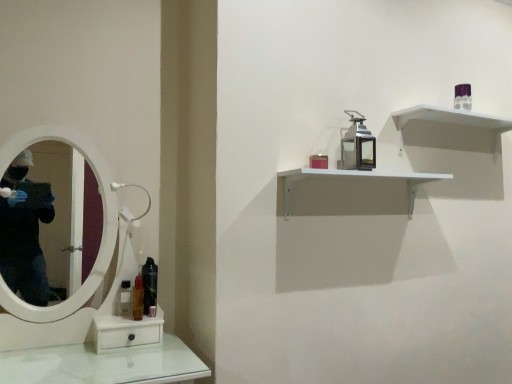
Question: Is black glossy mouthwash at lower left, the first mouthwash viewed from the right, facing away from white matte shelf at upper right, which ranks as the 2th shelf in top-to-bottom order?

Choices:
 (A) no
 (B) yes

Answer: (A)

Question: From a real-world perspective, is black glossy mouthwash at lower left, which appears as the third mouthwash when viewed from the left, on top of white matte shelf at upper right, which ranks as the 1th shelf in bottom-to-top order?

Choices:
 (A) yes
 (B) no

Answer: (B)

Question: Is black glossy mouthwash at lower left, which appears as the third mouthwash when viewed from the left, shorter than white matte shelf at upper right, which ranks as the 2th shelf in top-to-bottom order?

Choices:
 (A) yes
 (B) no

Answer: (A)

Question: Is white matte shelf at upper right, which ranks as the 2th shelf in top-to-bottom order, surrounded by black glossy mouthwash at lower left, the first mouthwash viewed from the right?

Choices:
 (A) no
 (B) yes

Answer: (A)

Question: Considering the relative sizes of black glossy mouthwash at lower left, the first mouthwash viewed from the right, and white matte shelf at upper right, which ranks as the 2th shelf in top-to-bottom order, in the image provided, is black glossy mouthwash at lower left, the first mouthwash viewed from the right, taller than white matte shelf at upper right, which ranks as the 2th shelf in top-to-bottom order,?

Choices:
 (A) no
 (B) yes

Answer: (A)

Question: From the image's perspective, is black glossy mouthwash at lower left, the first mouthwash viewed from the right, located beneath white matte shelf at upper right, which ranks as the 2th shelf in top-to-bottom order?

Choices:
 (A) yes
 (B) no

Answer: (A)

Question: Is translucent plastic mouthwash at left, which ranks as the second mouthwash in left-to-right order, positioned beyond the bounds of white matte shelf at upper right, which ranks as the 1th shelf in bottom-to-top order?

Choices:
 (A) no
 (B) yes

Answer: (B)

Question: Can you confirm if translucent plastic mouthwash at left, marked as the 2th mouthwash in a right-to-left arrangement, is positioned to the right of white matte shelf at upper right, which ranks as the 2th shelf in top-to-bottom order?

Choices:
 (A) yes
 (B) no

Answer: (B)

Question: Is translucent plastic mouthwash at left, marked as the 2th mouthwash in a right-to-left arrangement, positioned before white matte shelf at upper right, which ranks as the 2th shelf in top-to-bottom order?

Choices:
 (A) yes
 (B) no

Answer: (B)

Question: From a real-world perspective, does translucent plastic mouthwash at left, marked as the 2th mouthwash in a right-to-left arrangement, sit lower than white matte shelf at upper right, which ranks as the 2th shelf in top-to-bottom order?

Choices:
 (A) yes
 (B) no

Answer: (A)

Question: Is translucent plastic mouthwash at left, marked as the 2th mouthwash in a right-to-left arrangement, further to the viewer compared to white matte shelf at upper right, which ranks as the 1th shelf in bottom-to-top order?

Choices:
 (A) yes
 (B) no

Answer: (A)

Question: Does translucent plastic mouthwash at left, marked as the 2th mouthwash in a right-to-left arrangement, turn towards white matte shelf at upper right, which ranks as the 2th shelf in top-to-bottom order?

Choices:
 (A) yes
 (B) no

Answer: (B)

Question: Is purple glossy perfume at upper right, the 1th toiletry in the right-to-left sequence, facing away from clear plastic bottle at lower left, which is the 3th mouthwash in right-to-left order?

Choices:
 (A) no
 (B) yes

Answer: (A)